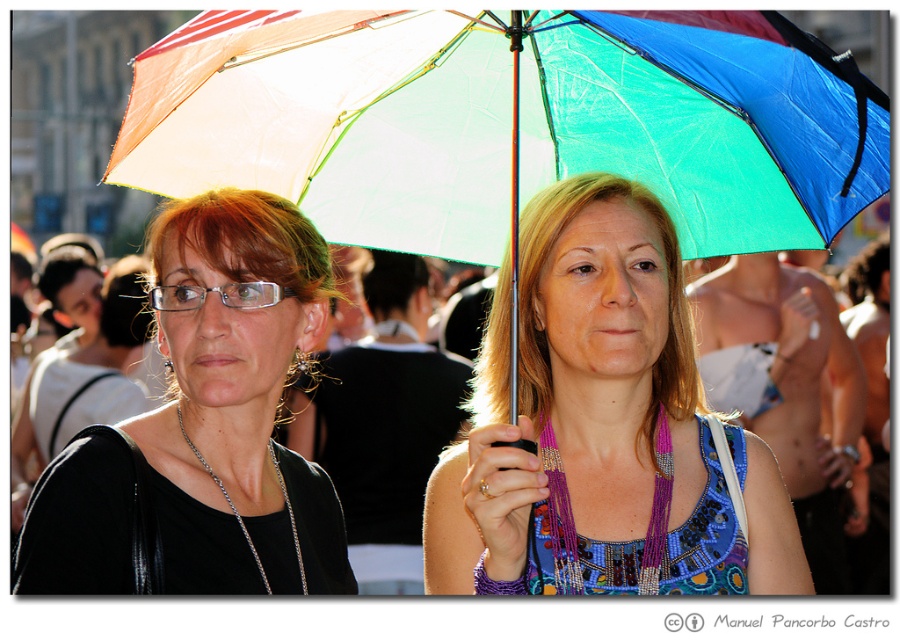
Is rainbow fabric umbrella at center bigger than multicolored fabric umbrella at center?

Yes.

What do you see at coordinates (509, 122) in the screenshot? I see `rainbow fabric umbrella at center` at bounding box center [509, 122].

The image size is (900, 640). I want to click on rainbow fabric umbrella at center, so click(x=509, y=122).

Is point (353, 81) positioned behind point (228, 458)?

No, it is in front of (228, 458).

Between rainbow fabric umbrella at center and matte black shirt at upper left, which one has more height?

matte black shirt at upper left is taller.

Is point (740, 147) closer to camera compared to point (147, 454)?

Yes, it is in front of point (147, 454).

The image size is (900, 640). Find the location of `rainbow fabric umbrella at center`. rainbow fabric umbrella at center is located at coordinates (509, 122).

What do you see at coordinates (603, 428) in the screenshot? I see `multicolored fabric umbrella at center` at bounding box center [603, 428].

Who is more distant from viewer, (531, 512) or (223, 506)?

Point (223, 506)

Locate an element on the screen. multicolored fabric umbrella at center is located at coordinates (603, 428).